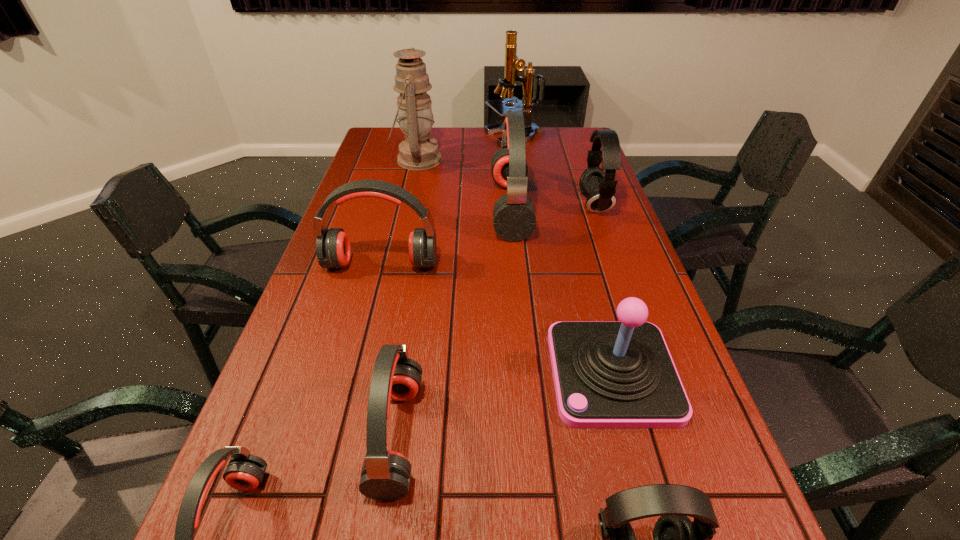
The image size is (960, 540). In order to click on vacant point located 0.360m forward from the base of the pink joystick in this screenshot , I will do `click(383, 373)`.

This screenshot has width=960, height=540. Find the location of `vacant space located forward from the base of the pink joystick`. vacant space located forward from the base of the pink joystick is located at coordinates (449, 373).

Where is `vacant area situated 0.280m forward from the base of the pink joystick`? vacant area situated 0.280m forward from the base of the pink joystick is located at coordinates (420, 373).

Find the location of a particular element. The image size is (960, 540). blank area located on the ear cups of the second smallest red earphone is located at coordinates (461, 436).

The width and height of the screenshot is (960, 540). I want to click on microscope that is at the far edge, so click(x=513, y=64).

Locate an element on the screen. This screenshot has width=960, height=540. oil lamp located in the far edge section of the desktop is located at coordinates (419, 152).

Where is `oil lamp that is positioned at the left edge`? The image size is (960, 540). oil lamp that is positioned at the left edge is located at coordinates (419, 152).

At what (x,y) coordinates should I click in order to perform the action: click on earphone that is at the left edge. Please return your answer as a coordinate pair (x, y). Looking at the image, I should click on (333, 249).

Image resolution: width=960 pixels, height=540 pixels. In order to click on earphone situated at the right edge in this screenshot , I will do `click(598, 186)`.

Find the location of a particular element. The image size is (960, 540). joystick present at the right edge is located at coordinates (607, 374).